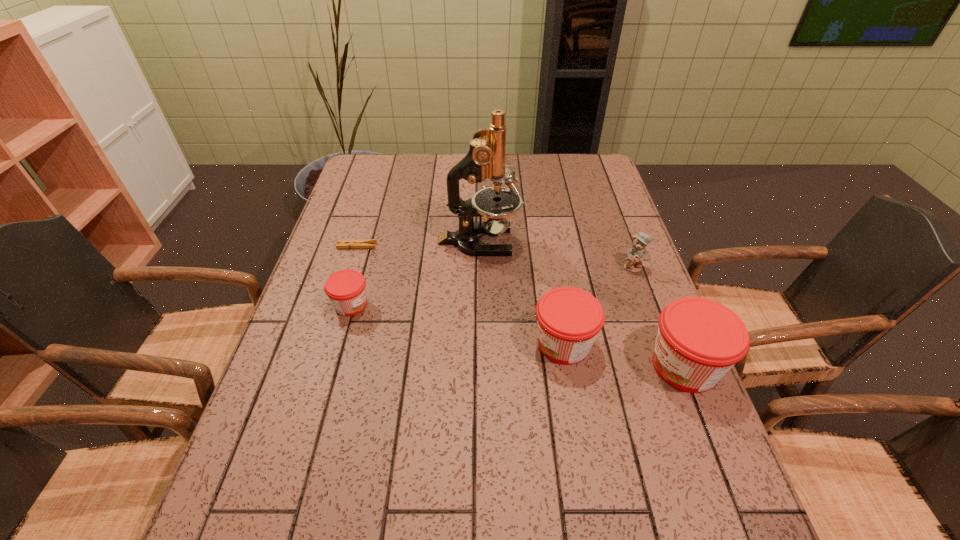
I want to click on the shortest jam, so click(x=346, y=289).

In order to click on the fifth tallest object in this screenshot , I will do `click(346, 289)`.

Locate an element on the screen. the second tallest jam is located at coordinates (569, 319).

Where is `the fourth object from left to right`? the fourth object from left to right is located at coordinates (569, 319).

Where is `the rightmost jam`? the rightmost jam is located at coordinates (699, 340).

Identify the location of teddy bear. (638, 253).

Find the location of a particular element. The image size is (960, 540). the tallest object is located at coordinates (486, 158).

What are the coordinates of `microscope` in the screenshot? It's located at (486, 158).

At what (x,y) coordinates should I click in order to perform the action: click on clothespin. Please return your answer as a coordinate pair (x, y). Image resolution: width=960 pixels, height=540 pixels. Looking at the image, I should click on (365, 243).

Locate an element on the screen. This screenshot has height=540, width=960. free space located on the label side of the shortest jam is located at coordinates (528, 305).